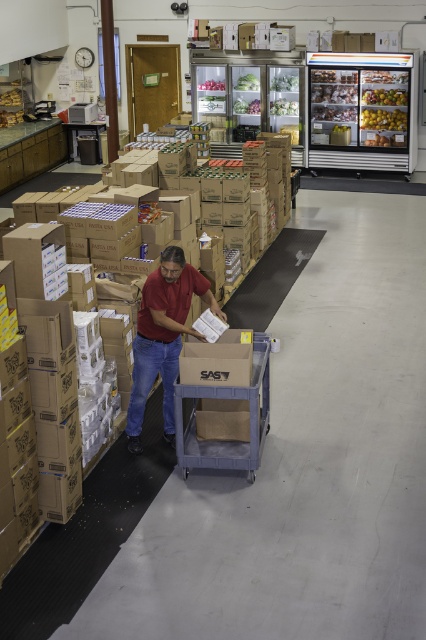
Is gray plastic cart at center shorter than shiny plastic apples at upper center?

No.

Does gray plastic cart at center have a lesser width compared to shiny plastic apples at upper center?

No, gray plastic cart at center is not thinner than shiny plastic apples at upper center.

Is point (256, 419) farther from camera compared to point (403, 100)?

No.

Find the location of a particular element. Image resolution: width=426 pixels, height=640 pixels. gray plastic cart at center is located at coordinates [224, 400].

Is point (184, 326) more distant than point (397, 129)?

No, it is in front of (397, 129).

Can you confirm if matte red shirt at center is bigger than yellow matte apples at upper center?

Correct, matte red shirt at center is larger in size than yellow matte apples at upper center.

The height and width of the screenshot is (640, 426). What do you see at coordinates (163, 337) in the screenshot? I see `matte red shirt at center` at bounding box center [163, 337].

At what (x,y) coordinates should I click in order to perform the action: click on matte red shirt at center. Please return your answer as a coordinate pair (x, y). Looking at the image, I should click on (163, 337).

Is gray plastic cart at center smaller than yellow matte apples at upper center?

Actually, gray plastic cart at center might be larger than yellow matte apples at upper center.

Can you confirm if gray plastic cart at center is wider than yellow matte apples at upper center?

No, gray plastic cart at center is not wider than yellow matte apples at upper center.

Is point (264, 358) less distant than point (367, 125)?

Yes, it is in front of point (367, 125).

You are a GUI agent. You are given a task and a screenshot of the screen. Output one action in this format:
    pyautogui.click(x=<x>, y=<y>)
    Task: Click on the gray plastic cart at center
    The height and width of the screenshot is (640, 426).
    Given the screenshot: What is the action you would take?
    (224, 400)